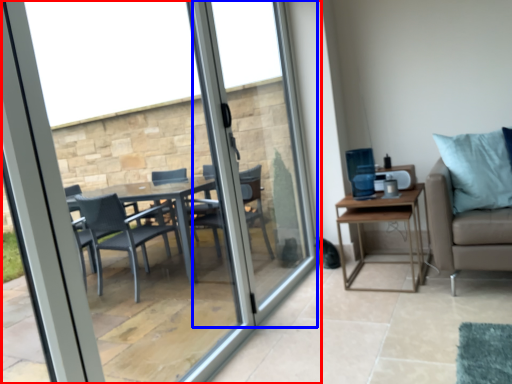
Question: Which object is closer to the camera taking this photo, window (highlighted by a red box) or screen door (highlighted by a blue box)?

Choices:
 (A) window
 (B) screen door

Answer: (A)